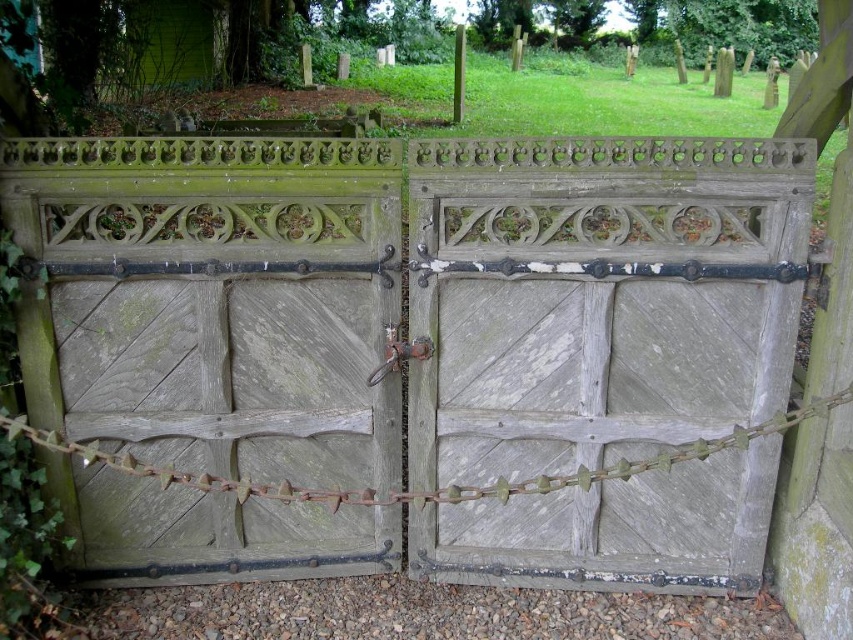
Question: Can you confirm if green wood gate at center is positioned below weathered wood gate at center?

Choices:
 (A) no
 (B) yes

Answer: (B)

Question: Can you confirm if green wood gate at center is positioned above weathered wood gate at center?

Choices:
 (A) yes
 (B) no

Answer: (B)

Question: Which of the following is the closest to the observer?

Choices:
 (A) weathered wood gate at center
 (B) green wood gate at center

Answer: (B)

Question: Which of the following is the farthest from the observer?

Choices:
 (A) (741, 307)
 (B) (474, 508)

Answer: (B)

Question: Is green wood gate at center smaller than weathered wood gate at center?

Choices:
 (A) yes
 (B) no

Answer: (B)